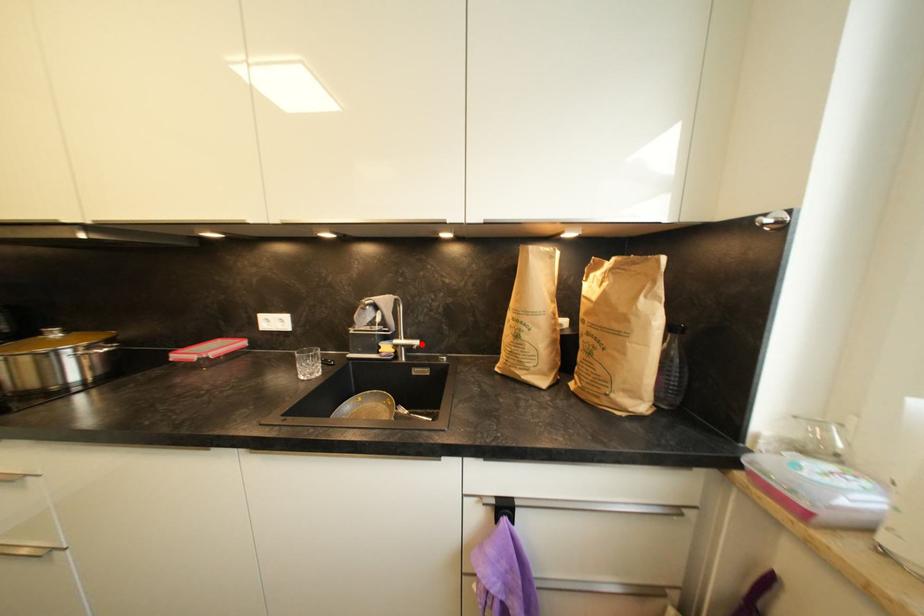
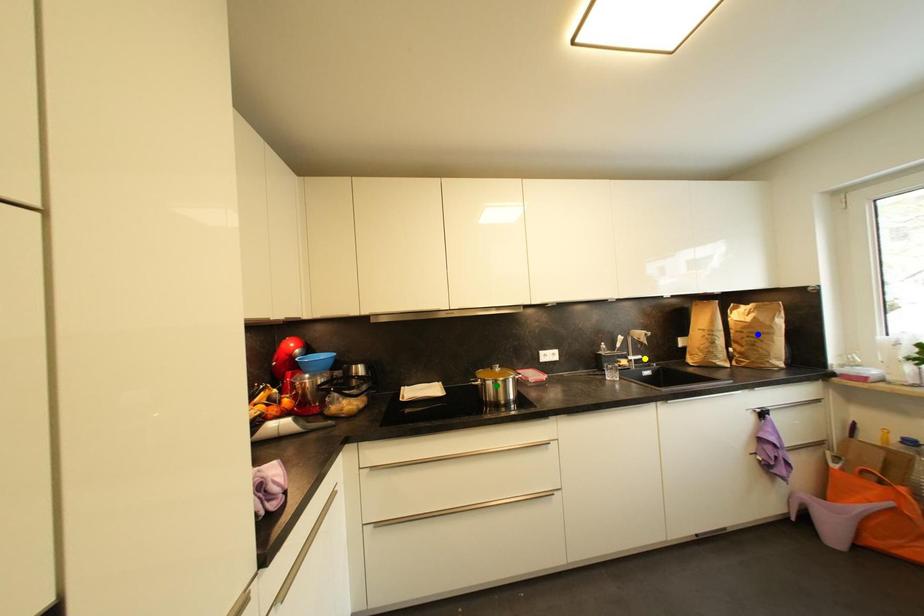
Question: I am providing you with two images of the same scene from different viewpoints. A red point is marked on the first image. You are given multiple points on the second image. Which point in image 2 is actually the same real-world point as the red point in image 1?

Choices:
 (A) green point
 (B) yellow point
 (C) blue point

Answer: (B)